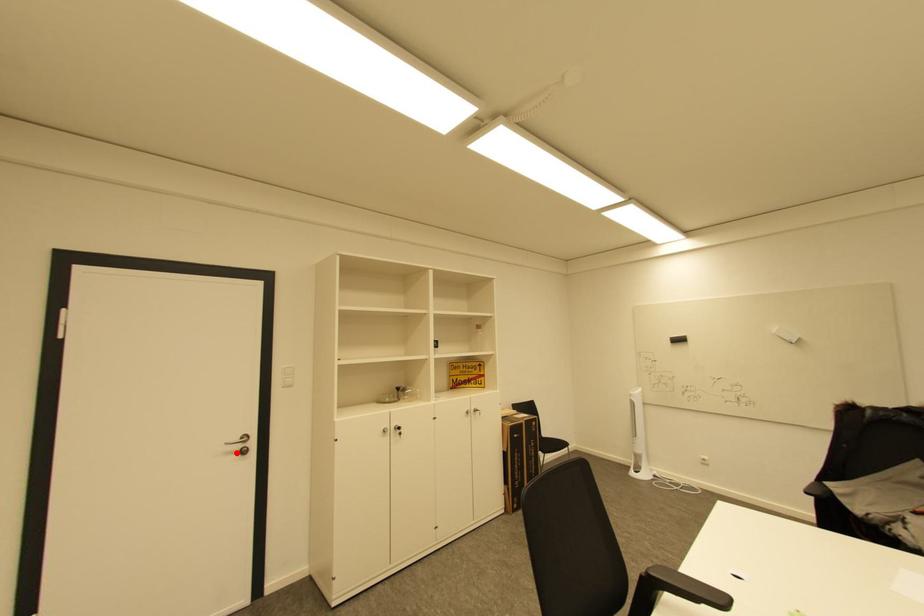
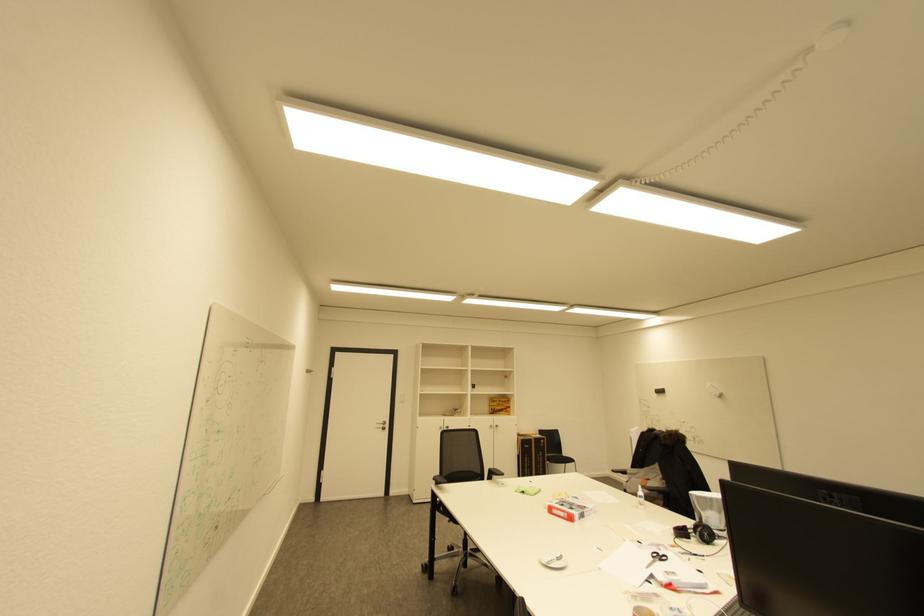
Question: I am providing you with two images of the same scene from different viewpoints. Image1 has a red point marked. In image2, the corresponding 3D location appears at what relative position? Reply with the corresponding letter.

Choices:
 (A) Closer
 (B) Farther

Answer: (B)